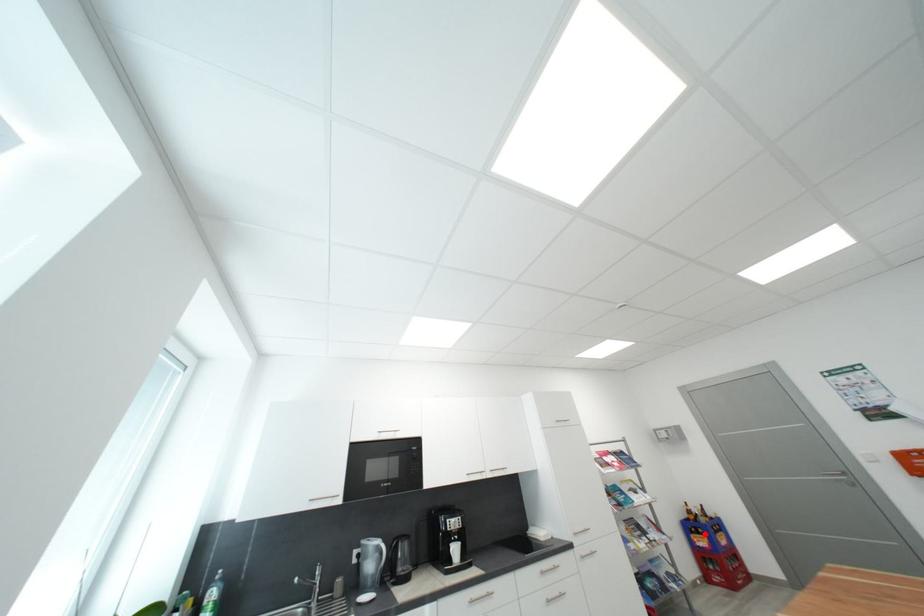
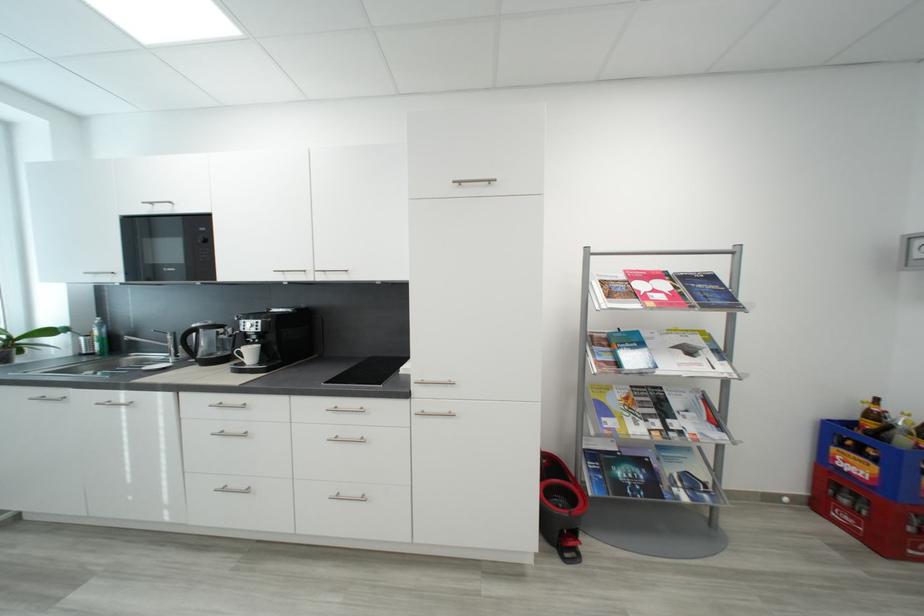
Question: A red point is marked in image1. In image2, is the corresponding 3D point closer to the camera or farther? Reply with the corresponding letter.

Choices:
 (A) The corresponding 3D point is closer.
 (B) The corresponding 3D point is farther.

Answer: (A)